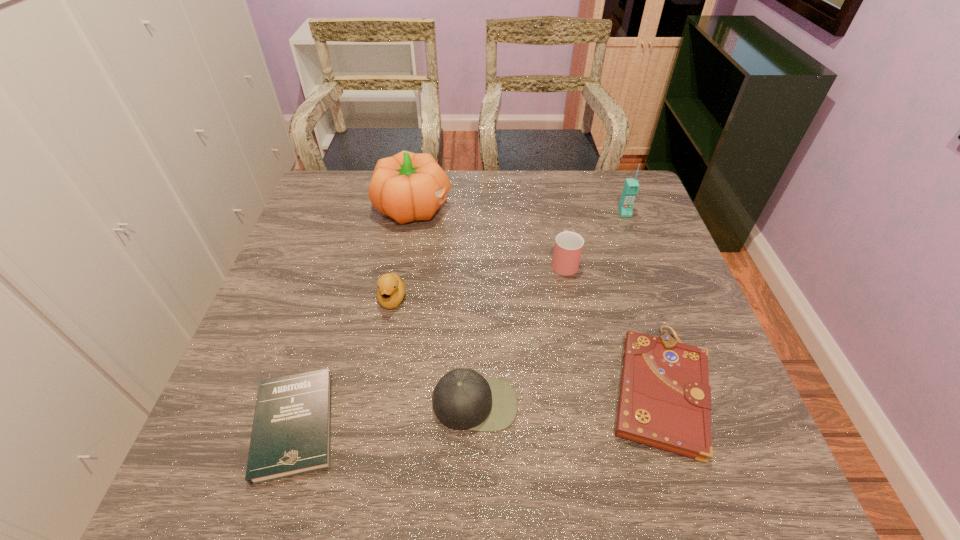
This screenshot has width=960, height=540. In order to click on free space at the far right corner of the desktop in this screenshot , I will do `click(612, 201)`.

You are a GUI agent. You are given a task and a screenshot of the screen. Output one action in this format:
    pyautogui.click(x=<x>, y=<y>)
    Task: Click on the unoccupied position between the pumpkin and the fifth nearest object
    The width and height of the screenshot is (960, 540).
    Given the screenshot: What is the action you would take?
    pyautogui.click(x=489, y=234)

You are a GUI agent. You are given a task and a screenshot of the screen. Output one action in this format:
    pyautogui.click(x=<x>, y=<y>)
    Task: Click on the free point between the sixth tallest object and the cellular telephone
    
    Given the screenshot: What is the action you would take?
    pyautogui.click(x=642, y=301)

Find the location of a particular element. free space that is in between the notebook and the cap is located at coordinates (567, 397).

Identify the location of vacant area that lies between the notebook and the cap. (567, 397).

Locate an element on the screen. This screenshot has width=960, height=540. free space that is in between the second shortest object and the cellular telephone is located at coordinates (642, 301).

You are a GUI agent. You are given a task and a screenshot of the screen. Output one action in this format:
    pyautogui.click(x=<x>, y=<y>)
    Task: Click on the free space between the cellular telephone and the sixth tallest object
    
    Given the screenshot: What is the action you would take?
    pyautogui.click(x=642, y=301)

Where is `vacant space that is in between the book and the third farthest object`? vacant space that is in between the book and the third farthest object is located at coordinates click(429, 343).

You are a GUI agent. You are given a task and a screenshot of the screen. Output one action in this format:
    pyautogui.click(x=<x>, y=<y>)
    Task: Click on the empty space between the cellular telephone and the notebook
    
    Given the screenshot: What is the action you would take?
    pyautogui.click(x=642, y=301)

Where is `empty location between the duckling and the second shortest object`? The width and height of the screenshot is (960, 540). empty location between the duckling and the second shortest object is located at coordinates (526, 345).